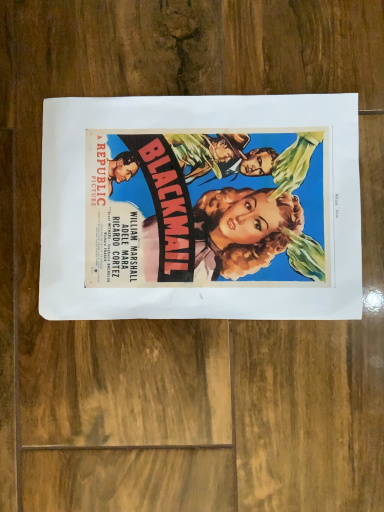
The height and width of the screenshot is (512, 384). What do you see at coordinates (191, 130) in the screenshot? I see `matte paper poster at center` at bounding box center [191, 130].

This screenshot has height=512, width=384. Find the location of `matte paper poster at center`. matte paper poster at center is located at coordinates (191, 130).

Locate an element on the screen. This screenshot has width=384, height=512. matte paper poster at center is located at coordinates (191, 130).